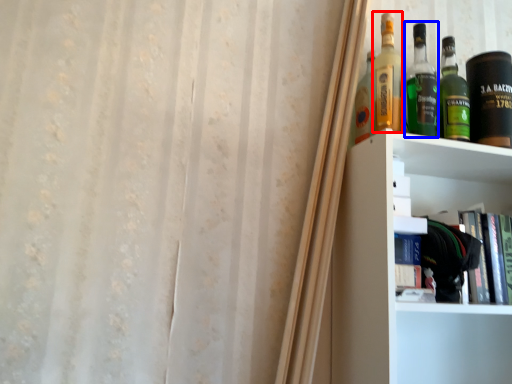
Question: Which object is further to the camera taking this photo, bottle (highlighted by a red box) or bottle (highlighted by a blue box)?

Choices:
 (A) bottle
 (B) bottle

Answer: (B)